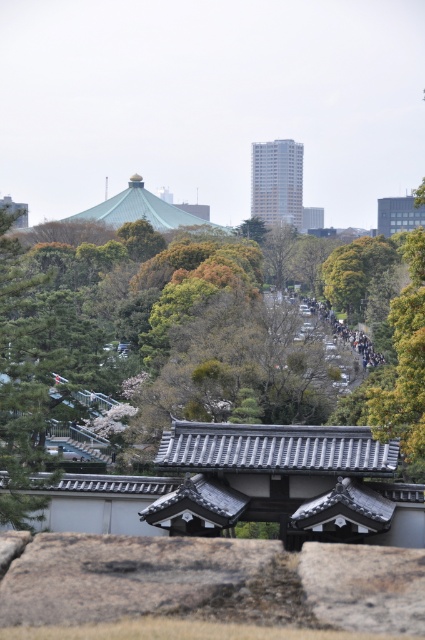
How distant is green leafy tree at center from matte gray stone temple at upper center?

green leafy tree at center and matte gray stone temple at upper center are 126.77 meters apart.

Identify the location of green leafy tree at center. The width and height of the screenshot is (425, 640). (240, 417).

Locate an element on the screen. The image size is (425, 640). green leafy tree at center is located at coordinates (240, 417).

Identify the location of matte gray temple at upper center. (277, 180).

Is matte gray temple at upper center behind matte gray stone temple at upper center?

Yes, matte gray temple at upper center is behind matte gray stone temple at upper center.

Which is behind, point (286, 216) or point (396, 228)?

The point (286, 216) is more distant.

This screenshot has width=425, height=640. I want to click on matte gray temple at upper center, so click(x=277, y=180).

Measure the distance between matte gray temple at upper center and dark gray concrete crowd at center.

matte gray temple at upper center and dark gray concrete crowd at center are 86.82 meters apart from each other.

Does matte gray temple at upper center have a lesser height compared to dark gray concrete crowd at center?

No, matte gray temple at upper center is not shorter than dark gray concrete crowd at center.

What do you see at coordinates (277, 180) in the screenshot?
I see `matte gray temple at upper center` at bounding box center [277, 180].

Where is `matte gray temple at upper center`? This screenshot has height=640, width=425. matte gray temple at upper center is located at coordinates (277, 180).